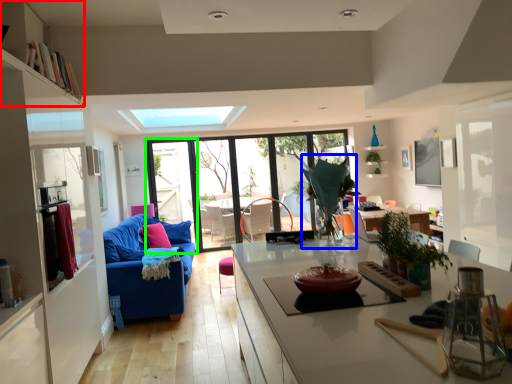
Question: Which object is positioned farthest from shelf (highlighted by a red box)? Select from plant (highlighted by a blue box) and screen door (highlighted by a green box).

Choices:
 (A) plant
 (B) screen door

Answer: (B)